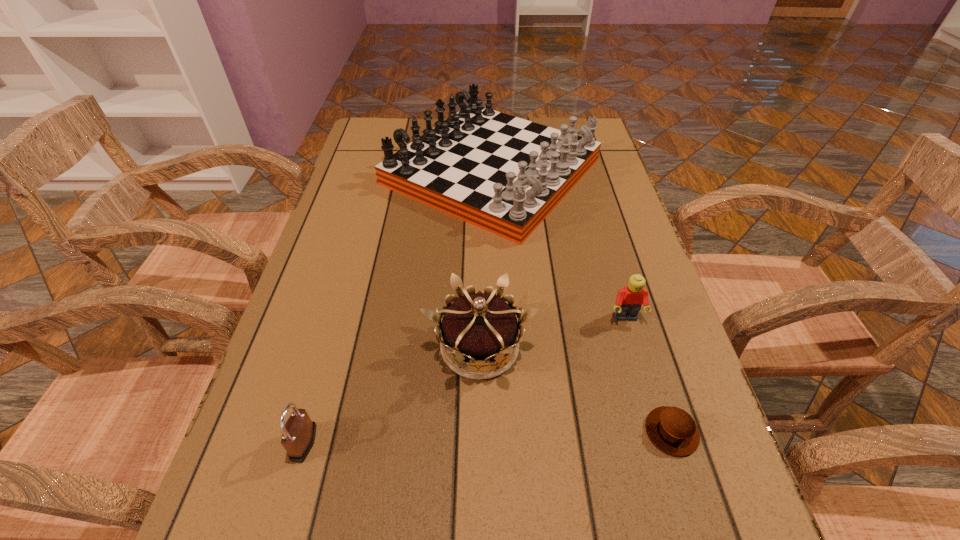
The image size is (960, 540). I want to click on the farthest object, so click(501, 173).

Identify the location of crown. (479, 327).

You are a GUI agent. You are given a task and a screenshot of the screen. Output one action in this format:
    pyautogui.click(x=<x>, y=<y>)
    Task: Click on the Lego
    The width and height of the screenshot is (960, 540).
    Given the screenshot: What is the action you would take?
    pyautogui.click(x=629, y=299)

Identify the location of padlock. (298, 434).

Where is `the shortest object`? This screenshot has height=540, width=960. the shortest object is located at coordinates 672,430.

The width and height of the screenshot is (960, 540). Identify the location of free location located on the front of the farthest object. (496, 301).

This screenshot has height=540, width=960. I want to click on free location located 0.220m on the right of the crown, so click(653, 347).

Locate an element on the screen. The image size is (960, 540). vacant area situated 0.310m on the face of the Lego is located at coordinates (678, 496).

Identify the location of free region located on the front of the padlock. The height and width of the screenshot is (540, 960). (286, 505).

Image resolution: width=960 pixels, height=540 pixels. I want to click on vacant region located 0.100m on the left of the shortest object, so click(584, 431).